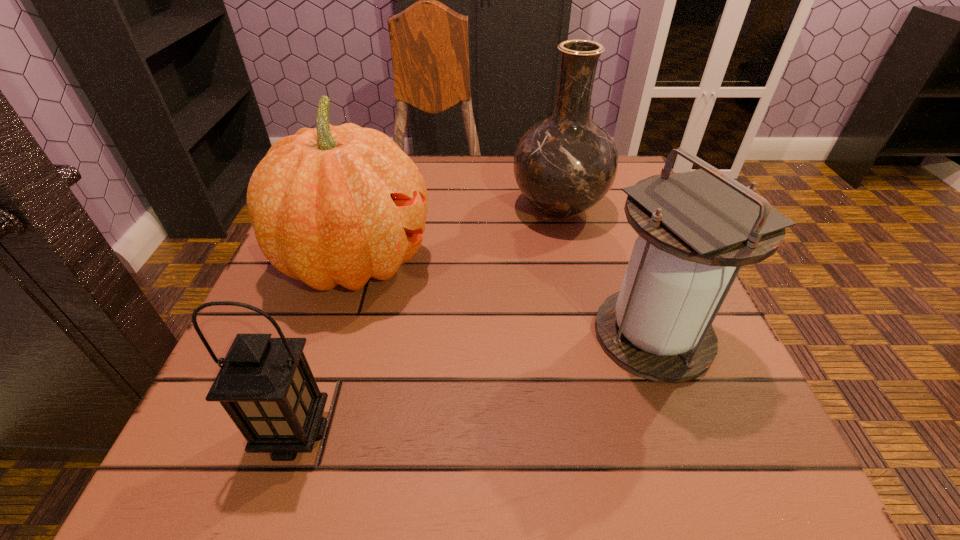
At what (x,y) coordinates should I click in order to perform the action: click on object situated at the near edge. Please return your answer as a coordinate pair (x, y). Looking at the image, I should click on (266, 386).

At what (x,y) coordinates should I click in order to perform the action: click on pumpkin located in the left edge section of the desktop. Please return your answer as a coordinate pair (x, y). The width and height of the screenshot is (960, 540). Looking at the image, I should click on (332, 205).

This screenshot has width=960, height=540. What are the coordinates of `lantern that is at the left edge` in the screenshot? It's located at (266, 386).

Find the location of a particular element. vase that is at the right edge is located at coordinates (565, 164).

Find the location of a particular element. lantern that is at the right edge is located at coordinates (696, 229).

Image resolution: width=960 pixels, height=540 pixels. Find the location of `object that is at the near left corner`. object that is at the near left corner is located at coordinates (266, 386).

Where is `object located in the far right corner section of the desktop`? The width and height of the screenshot is (960, 540). object located in the far right corner section of the desktop is located at coordinates tap(565, 164).

Find the location of a particular element. This screenshot has width=960, height=540. vacant space at the far edge is located at coordinates (506, 204).

In the image, there is a desktop. At what (x,y) coordinates should I click in order to perform the action: click on blank space at the left edge. Please return your answer as a coordinate pair (x, y). Image resolution: width=960 pixels, height=540 pixels. Looking at the image, I should click on (307, 315).

Where is `free region at the far right corner of the desktop`? This screenshot has height=540, width=960. free region at the far right corner of the desktop is located at coordinates (603, 206).